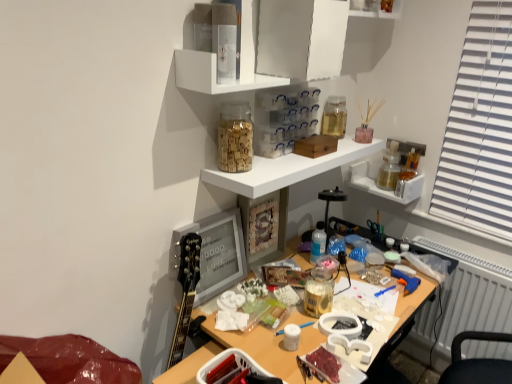
Question: Can you confirm if transparent glass jar at upper center, the fourth shelf ordered from the bottom, is thinner than white glossy shelf at upper center, the third shelf from the bottom?

Choices:
 (A) yes
 (B) no

Answer: (B)

Question: Does transparent glass jar at upper center, the fourth shelf ordered from the bottom, appear on the right side of white glossy shelf at upper center, placed as the 2th shelf when sorted from top to bottom?

Choices:
 (A) yes
 (B) no

Answer: (A)

Question: From the image's perspective, is transparent glass jar at upper center, the fourth shelf ordered from the bottom, on white glossy shelf at upper center, the third shelf from the bottom?

Choices:
 (A) no
 (B) yes

Answer: (B)

Question: Is transparent glass jar at upper center, positioned as the first shelf in top-to-bottom order, positioned in front of white glossy shelf at upper center, placed as the 2th shelf when sorted from top to bottom?

Choices:
 (A) yes
 (B) no

Answer: (B)

Question: From the image's perspective, is transparent glass jar at upper center, positioned as the first shelf in top-to-bottom order, below white glossy shelf at upper center, placed as the 2th shelf when sorted from top to bottom?

Choices:
 (A) no
 (B) yes

Answer: (A)

Question: Looking at the image, does white matte jar at center, which is counted as the 3th stationery, starting from the back, seem bigger or smaller compared to wooden alphabet blocks at upper center, which is counted as the second stationery, starting from the back?

Choices:
 (A) small
 (B) big

Answer: (A)

Question: Is point (293, 331) closer or farther from the camera than point (224, 137)?

Choices:
 (A) closer
 (B) farther

Answer: (A)

Question: In the image, is white matte jar at center, the 2th stationery from the left, positioned in front of or behind wooden alphabet blocks at upper center, which is the 2th stationery in front-to-back order?

Choices:
 (A) behind
 (B) front

Answer: (B)

Question: Is white matte jar at center, which appears as the 1th stationery when ordered from the bottom, inside the boundaries of wooden alphabet blocks at upper center, which appears as the second stationery when viewed from the top, or outside?

Choices:
 (A) inside
 (B) outside

Answer: (B)

Question: From the image's perspective, is white glossy shelf at upper center, placed as the 2th shelf when sorted from top to bottom, above or below transparent glass jar at upper center, the fourth shelf ordered from the bottom?

Choices:
 (A) below
 (B) above

Answer: (A)

Question: Does point (231, 87) appear closer or farther from the camera than point (365, 1)?

Choices:
 (A) farther
 (B) closer

Answer: (B)

Question: Is white glossy shelf at upper center, the third shelf from the bottom, in front of or behind transparent glass jar at upper center, the fourth shelf ordered from the bottom, in the image?

Choices:
 (A) behind
 (B) front

Answer: (B)

Question: Is white glossy shelf at upper center, placed as the 2th shelf when sorted from top to bottom, wider or thinner than transparent glass jar at upper center, the fourth shelf ordered from the bottom?

Choices:
 (A) wide
 (B) thin

Answer: (B)

Question: Is translucent plastic bottle at center wider or thinner than transparent glass jar at upper center, the fourth shelf ordered from the bottom?

Choices:
 (A) wide
 (B) thin

Answer: (B)

Question: From the image's perspective, is translucent plastic bottle at center positioned above or below transparent glass jar at upper center, the fourth shelf ordered from the bottom?

Choices:
 (A) above
 (B) below

Answer: (B)